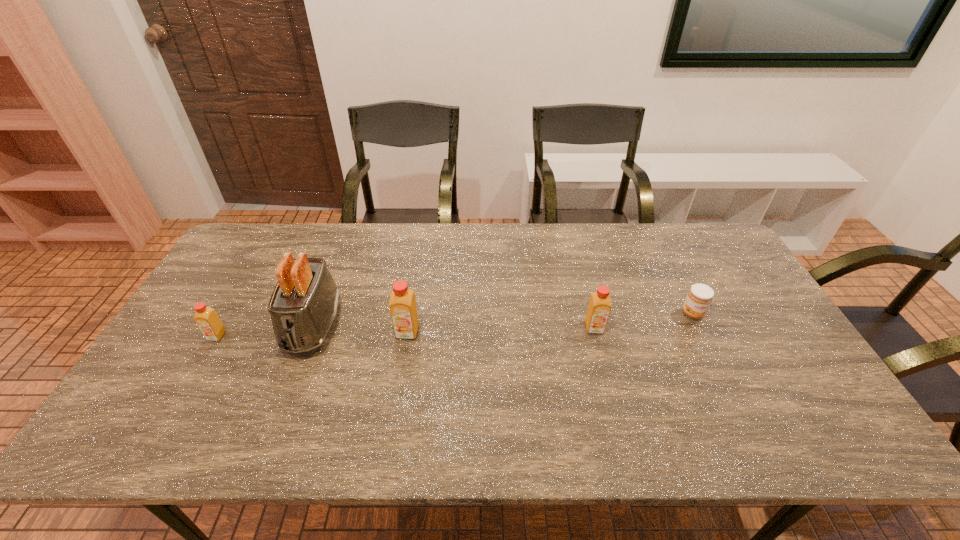
This screenshot has width=960, height=540. I want to click on free space between the fourth object from right to left and the second tallest object, so click(x=360, y=329).

This screenshot has height=540, width=960. In order to click on vacant point located between the second shortest orange juice and the toaster in this screenshot , I will do point(454,327).

In order to click on vacant point located between the jam and the toaster in this screenshot , I will do `click(503, 320)`.

I want to click on free spot between the jam and the second object from right to left, so click(x=643, y=321).

Find the location of `vacant space in between the fourth object from left to right and the third object from left to right`. vacant space in between the fourth object from left to right and the third object from left to right is located at coordinates (501, 330).

Image resolution: width=960 pixels, height=540 pixels. What are the coordinates of `vacant space in between the rightmost orange juice and the second object from left to right` in the screenshot? It's located at (454, 327).

At what (x,y) coordinates should I click in order to perform the action: click on vacant area that lies between the rightmost object and the second object from left to right. Please return your answer as a coordinate pair (x, y). The height and width of the screenshot is (540, 960). Looking at the image, I should click on (503, 320).

Where is `free space that is in between the rightmost orange juice and the fourth shortest object`? free space that is in between the rightmost orange juice and the fourth shortest object is located at coordinates (501, 330).

At what (x,y) coordinates should I click in order to perform the action: click on unoccupied position between the tallest orange juice and the rightmost orange juice. Please return your answer as a coordinate pair (x, y). This screenshot has width=960, height=540. Looking at the image, I should click on (501, 330).

Select which object is the second closest to the shortest orange juice. Please provide its 2D coordinates. Your answer should be formatted as a tuple, i.e. [(x, y)], where the tuple contains the x and y coordinates of a point satisfying the conditions above.

[(403, 310)]